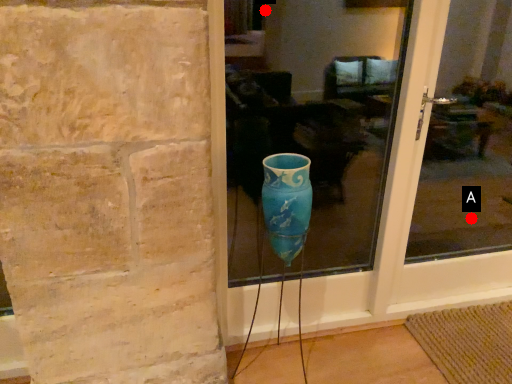
Question: Two points are circled on the image, labeled by A and B beside each circle. Among these points, which one is nearest to the camera?

Choices:
 (A) A is closer
 (B) B is closer

Answer: (B)